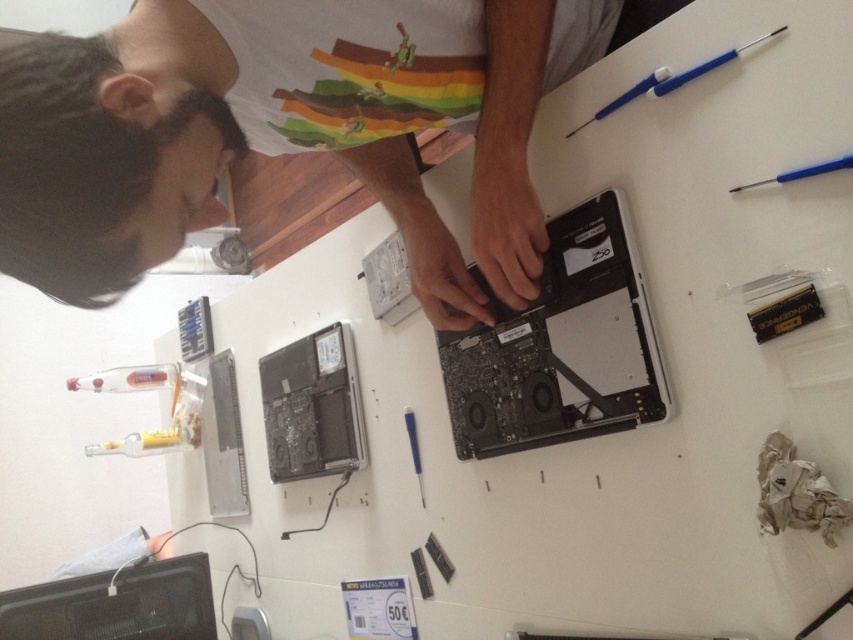
Based on the photo, you are a repair technician who needs to place a small tool on the table. The white matte shirt at upper center and the black plastic computer at center are both on the table. Which object has a larger width?

The white matte shirt at upper center might be wider than black plastic computer at center according to the description.

You are a technician trying to locate two specific points on the laptop motherboard. The points are labeled as point 1 at coordinates point (363, 48) and point 2 at coordinates point (512, 339). Which point is closer to the camera?

Point (363, 48) is closer to the camera than point (512, 339).